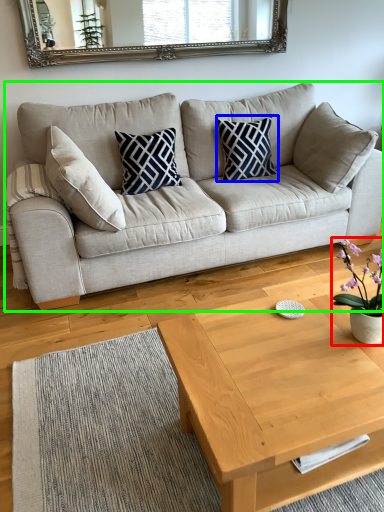
Question: Which is nearer to the houseplant (highlighted by a red box)? pillow (highlighted by a blue box) or studio couch (highlighted by a green box).

Choices:
 (A) pillow
 (B) studio couch

Answer: (B)